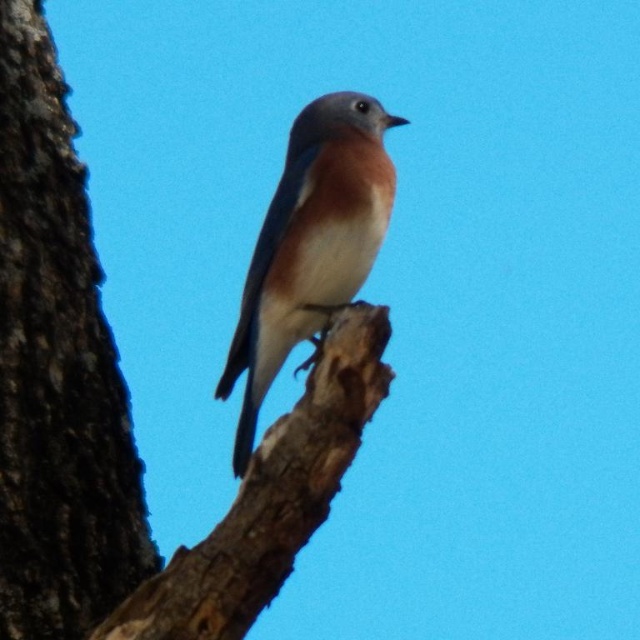
You are an ornithologist observing the Eastern Bluebird in the image. You need to place a small identification tag on either the dark brown rough bark at left or the brown rough tree branch at center. Which object should you choose if you want the tag to be more visible against the background?

The dark brown rough bark at left is larger in size than the brown rough tree branch at center, so placing the identification tag on the dark brown rough bark at left would provide a more visible surface for the tag.

You are standing 10 feet away from a tree branch with a bird on it. There is a point labeled as point (x=60, y=205). Can you reach that point with a 12 foot pole?

The point (x=60, y=205) is 10.79 feet away from the camera. Since you are standing 10 feet away from the tree branch, the total distance to the point would be 10 feet plus the distance from the branch to the point. However, the given information only states the point is 10.79 feet from the camera, so it is unclear if the 12 foot pole would be sufficient. More information is needed.